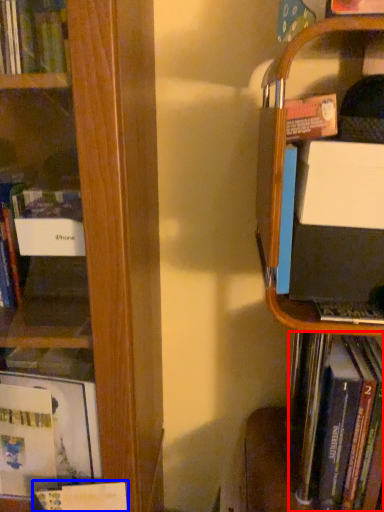
Question: Which object is further to the camera taking this photo, book (highlighted by a red box) or book (highlighted by a blue box)?

Choices:
 (A) book
 (B) book

Answer: (B)